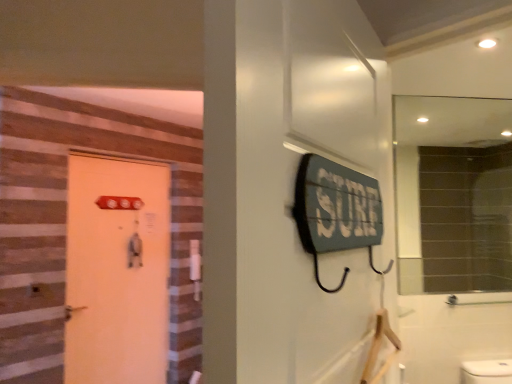
Question: Could you tell me if matte glass mirror at upper right is turned towards matte orange door at left?

Choices:
 (A) yes
 (B) no

Answer: (B)

Question: Is matte glass mirror at upper right to the left of matte orange door at left from the viewer's perspective?

Choices:
 (A) no
 (B) yes

Answer: (A)

Question: From a real-world perspective, is matte glass mirror at upper right physically above matte orange door at left?

Choices:
 (A) yes
 (B) no

Answer: (A)

Question: Does matte glass mirror at upper right have a greater height compared to matte orange door at left?

Choices:
 (A) yes
 (B) no

Answer: (B)

Question: Is matte glass mirror at upper right further to camera compared to matte orange door at left?

Choices:
 (A) no
 (B) yes

Answer: (A)

Question: Does matte glass mirror at upper right appear on the right side of matte orange door at left?

Choices:
 (A) no
 (B) yes

Answer: (B)

Question: Considering the relative sizes of matte orange door at left and matte glass mirror at upper right in the image provided, is matte orange door at left thinner than matte glass mirror at upper right?

Choices:
 (A) yes
 (B) no

Answer: (B)

Question: Is matte orange door at left smaller than matte glass mirror at upper right?

Choices:
 (A) yes
 (B) no

Answer: (B)

Question: Is matte orange door at left in contact with matte glass mirror at upper right?

Choices:
 (A) yes
 (B) no

Answer: (B)

Question: Considering the relative sizes of matte orange door at left and matte glass mirror at upper right in the image provided, is matte orange door at left shorter than matte glass mirror at upper right?

Choices:
 (A) no
 (B) yes

Answer: (A)

Question: From a real-world perspective, is matte orange door at left positioned under matte glass mirror at upper right based on gravity?

Choices:
 (A) yes
 (B) no

Answer: (A)

Question: Would you say matte orange door at left is outside matte glass mirror at upper right?

Choices:
 (A) yes
 (B) no

Answer: (A)

Question: Is matte orange door at left in front of or behind matte glass mirror at upper right in the image?

Choices:
 (A) front
 (B) behind

Answer: (B)